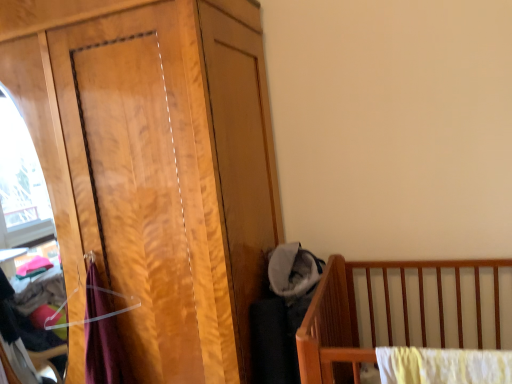
The height and width of the screenshot is (384, 512). What do you see at coordinates (293, 271) in the screenshot?
I see `soft gray fabric at center` at bounding box center [293, 271].

Where is `soft gray fabric at center`? The height and width of the screenshot is (384, 512). soft gray fabric at center is located at coordinates (293, 271).

Describe the element at coordinates (155, 165) in the screenshot. I see `wooden wardrobe at left` at that location.

Where is `wooden wardrobe at left`? This screenshot has width=512, height=384. wooden wardrobe at left is located at coordinates (155, 165).

Measure the distance between wooden wardrobe at left and camera.

A distance of 4.04 feet exists between wooden wardrobe at left and camera.

The image size is (512, 384). I want to click on soft gray fabric at center, so click(293, 271).

In the image, is soft gray fabric at center on the left side or the right side of wooden wardrobe at left?

Answer: In the image, soft gray fabric at center appears on the right side of wooden wardrobe at left.

Which object is more forward, soft gray fabric at center or wooden wardrobe at left?

wooden wardrobe at left is in front.

Is point (281, 274) more distant than point (262, 287)?

No, (281, 274) is closer to viewer.

From the image's perspective, which object appears higher, soft gray fabric at center or wooden wardrobe at left?

From the image's view, wooden wardrobe at left is above.

From a real-world perspective, who is located lower, soft gray fabric at center or wooden wardrobe at left?

soft gray fabric at center is physically lower.

Looking at this image, can you confirm if soft gray fabric at center is thinner than wooden wardrobe at left?

Indeed, soft gray fabric at center has a lesser width compared to wooden wardrobe at left.

Can you confirm if soft gray fabric at center is taller than wooden wardrobe at left?

Incorrect, the height of soft gray fabric at center is not larger of that of wooden wardrobe at left.

Considering the relative sizes of soft gray fabric at center and wooden wardrobe at left in the image provided, is soft gray fabric at center bigger than wooden wardrobe at left?

Incorrect, soft gray fabric at center is not larger than wooden wardrobe at left.

Can we say soft gray fabric at center lies outside wooden wardrobe at left?

That's correct, soft gray fabric at center is outside of wooden wardrobe at left.

Is soft gray fabric at center next to wooden wardrobe at left?

soft gray fabric at center and wooden wardrobe at left are clearly separated.

Is soft gray fabric at center positioned with its back to wooden wardrobe at left?

soft gray fabric at center is not turned away from wooden wardrobe at left.

How many degrees apart are the facing directions of soft gray fabric at center and wooden wardrobe at left?

The angle between the facing direction of soft gray fabric at center and the facing direction of wooden wardrobe at left is 6.99 degrees.

How much distance is there between soft gray fabric at center and wooden wardrobe at left?

22.47 inches.

Where is `baby clothe on the right of wooden wardrobe at left`? The image size is (512, 384). baby clothe on the right of wooden wardrobe at left is located at coordinates 293,271.

Is wooden wardrobe at left to the left or to the right of soft gray fabric at center in the image?

wooden wardrobe at left is to the left of soft gray fabric at center.

Is wooden wardrobe at left positioned before soft gray fabric at center?

Yes, it is in front of soft gray fabric at center.

Is point (268, 243) farther from camera compared to point (294, 289)?

Yes, point (268, 243) is behind point (294, 289).

From the image's perspective, is wooden wardrobe at left above soft gray fabric at center?

Yes, from the image's perspective, wooden wardrobe at left is on top of soft gray fabric at center.

From a real-world perspective, between wooden wardrobe at left and soft gray fabric at center, who is vertically lower?

soft gray fabric at center.

Does wooden wardrobe at left have a greater width compared to soft gray fabric at center?

Yes, wooden wardrobe at left is wider than soft gray fabric at center.

Which of these two, wooden wardrobe at left or soft gray fabric at center, stands shorter?

Standing shorter between the two is soft gray fabric at center.

Who is smaller, wooden wardrobe at left or soft gray fabric at center?

soft gray fabric at center is smaller.

Is wooden wardrobe at left located outside soft gray fabric at center?

Absolutely, wooden wardrobe at left is external to soft gray fabric at center.

Is wooden wardrobe at left far away from soft gray fabric at center?

No, wooden wardrobe at left is not far away from soft gray fabric at center.

Based on the photo, is wooden wardrobe at left aimed at soft gray fabric at center?

No, wooden wardrobe at left does not turn towards soft gray fabric at center.

At what (x,y) coordinates should I click in order to perform the action: click on baby clothe lying below the wooden wardrobe at left (from the image's perspective). Please return your answer as a coordinate pair (x, y). This screenshot has height=384, width=512. Looking at the image, I should click on (293, 271).

Identify the location of dresser that is on the left side of soft gray fabric at center. The width and height of the screenshot is (512, 384). (155, 165).

Where is `baby clothe beneath the wooden wardrobe at left (from a real-world perspective)`? baby clothe beneath the wooden wardrobe at left (from a real-world perspective) is located at coordinates (293, 271).